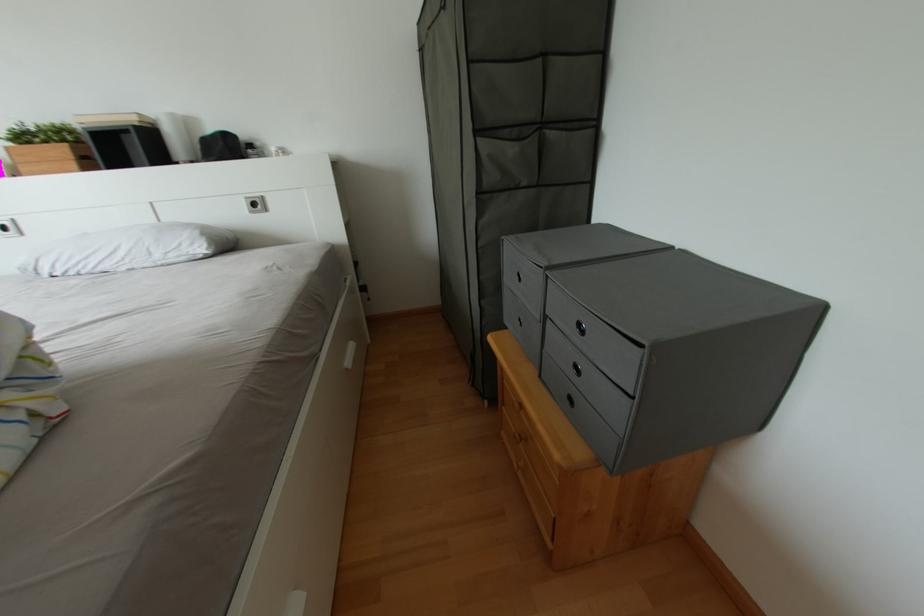
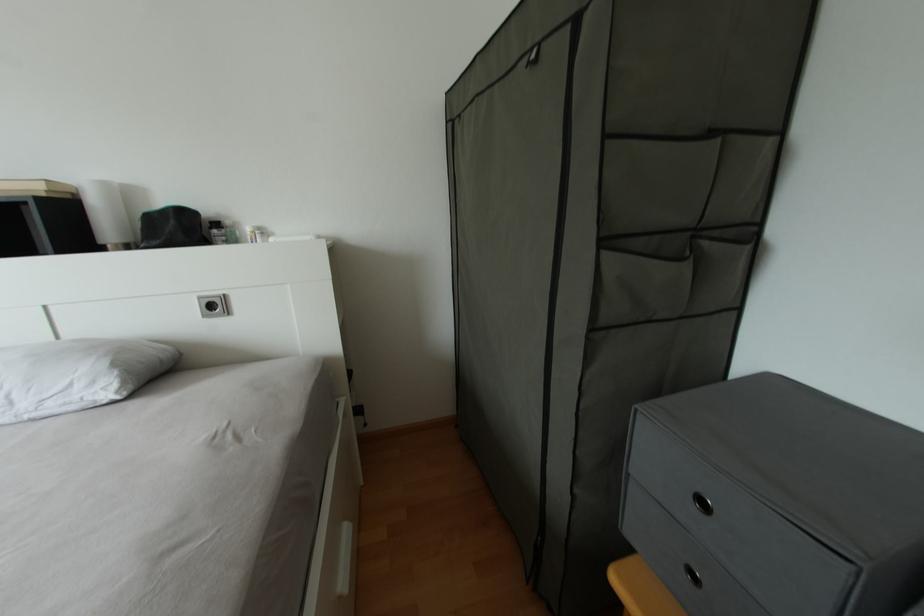
Which direction would the cameraman need to move to produce the second image?

The movement direction of the cameraman is left, forward.